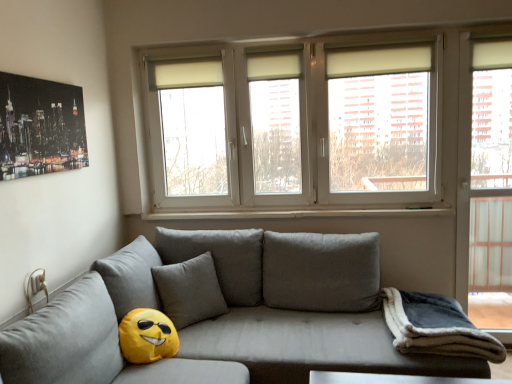
Locate an element on the screen. empty space that is ontop of beige fabric curtain at upper center, arranged as the 2th curtain when viewed from the back (from a real-world perspective) is located at coordinates (378, 38).